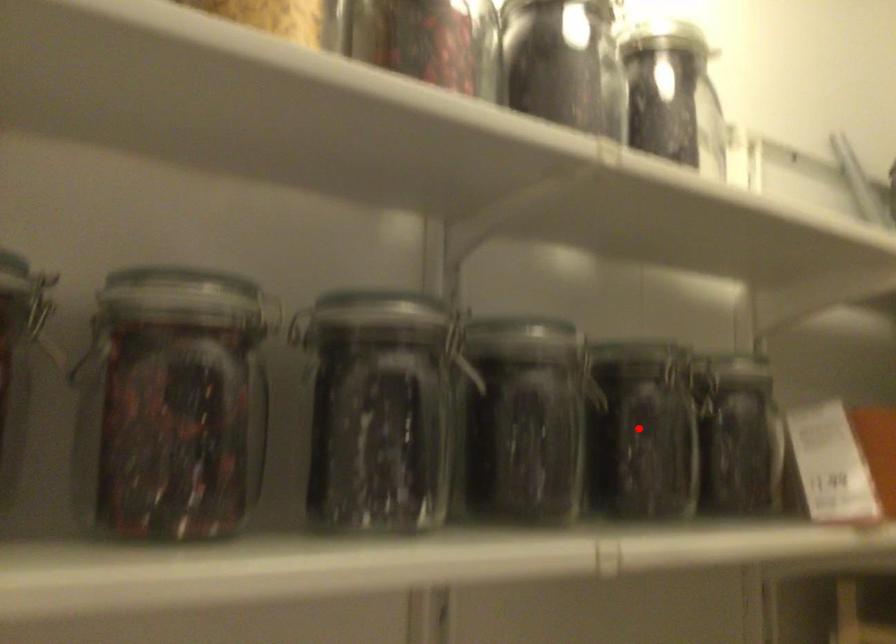
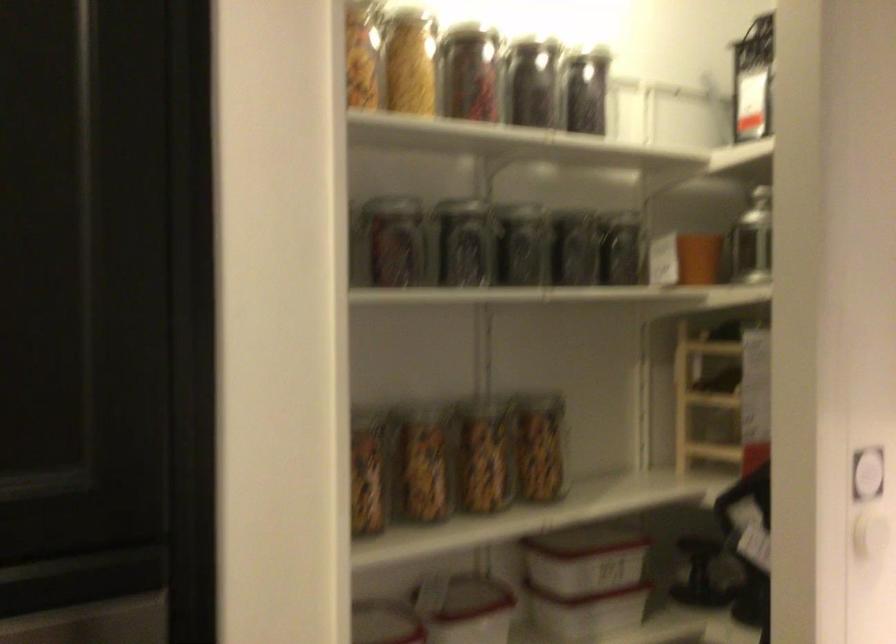
Locate, in the second image, the point that corresponds to the highlighted location in the first image.

(574, 249)